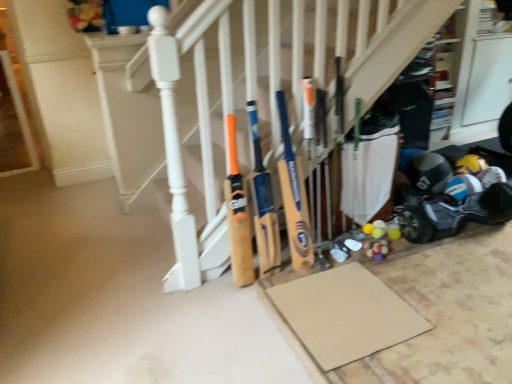
Question: Does wooden bat at center, the 1th baseball bat from the left, appear on the left side of yellow wood bat at center, which is the second baseball bat from left to right?

Choices:
 (A) yes
 (B) no

Answer: (A)

Question: Is wooden bat at center, the 1th baseball bat from the left, taller than yellow wood bat at center, which is the 1th baseball bat from right to left?

Choices:
 (A) yes
 (B) no

Answer: (B)

Question: Is wooden bat at center, the 1th baseball bat from the left, thinner than yellow wood bat at center, which is the 1th baseball bat from right to left?

Choices:
 (A) yes
 (B) no

Answer: (A)

Question: Is wooden bat at center, the second baseball bat positioned from the right, next to yellow wood bat at center, which is the second baseball bat from left to right, and touching it?

Choices:
 (A) yes
 (B) no

Answer: (B)

Question: From a real-world perspective, is wooden bat at center, the second baseball bat positioned from the right, physically below yellow wood bat at center, which is the second baseball bat from left to right?

Choices:
 (A) yes
 (B) no

Answer: (A)

Question: From the image's perspective, is wooden bat at center, the second baseball bat positioned from the right, over yellow wood bat at center, which is the second baseball bat from left to right?

Choices:
 (A) yes
 (B) no

Answer: (B)

Question: Is matte black helmet at lower right shorter than wooden bat at center, the 1th baseball bat from the left?

Choices:
 (A) no
 (B) yes

Answer: (B)

Question: From a real-world perspective, is matte black helmet at lower right physically above wooden bat at center, the 1th baseball bat from the left?

Choices:
 (A) no
 (B) yes

Answer: (A)

Question: Is matte black helmet at lower right wider than wooden bat at center, the second baseball bat positioned from the right?

Choices:
 (A) yes
 (B) no

Answer: (A)

Question: Is matte black helmet at lower right closer to the viewer compared to wooden bat at center, the second baseball bat positioned from the right?

Choices:
 (A) no
 (B) yes

Answer: (A)

Question: Is matte black helmet at lower right looking in the opposite direction of wooden bat at center, the 1th baseball bat from the left?

Choices:
 (A) no
 (B) yes

Answer: (A)

Question: Is matte black helmet at lower right completely or partially outside of wooden bat at center, the 1th baseball bat from the left?

Choices:
 (A) no
 (B) yes

Answer: (B)

Question: Is yellow wood bat at center, which is the 1th baseball bat from right to left, thinner than blue plastic baby carriage at lower right?

Choices:
 (A) yes
 (B) no

Answer: (A)